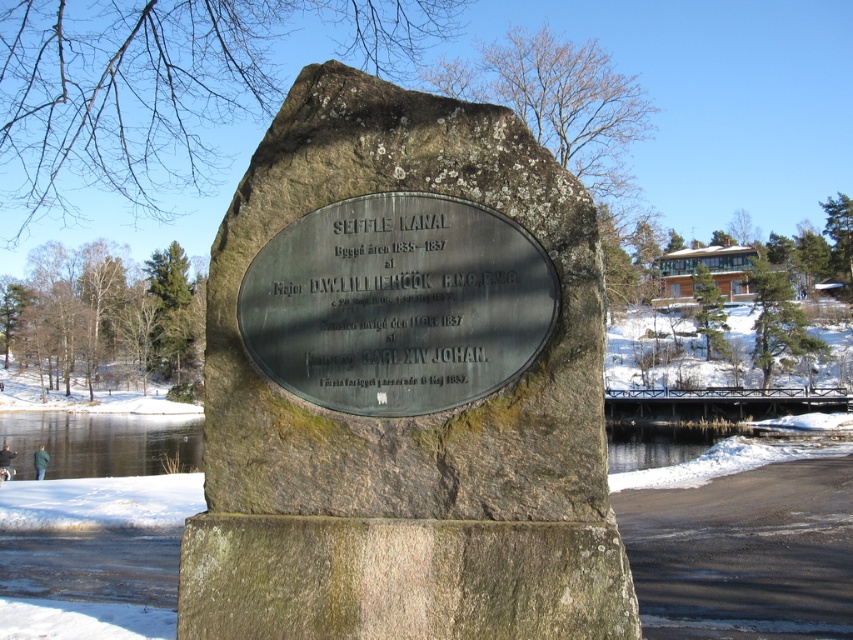
In the scene shown: Is green mossy stone monument at center to the right of green polished stone plaque at center from the viewer's perspective?

Incorrect, green mossy stone monument at center is not on the right side of green polished stone plaque at center.

Who is positioned more to the right, green mossy stone monument at center or green polished stone plaque at center?

green polished stone plaque at center is more to the right.

Is point (366, 308) positioned behind point (384, 227)?

No, (366, 308) is closer to viewer.

Identify the location of green mossy stone monument at center. [403, 384].